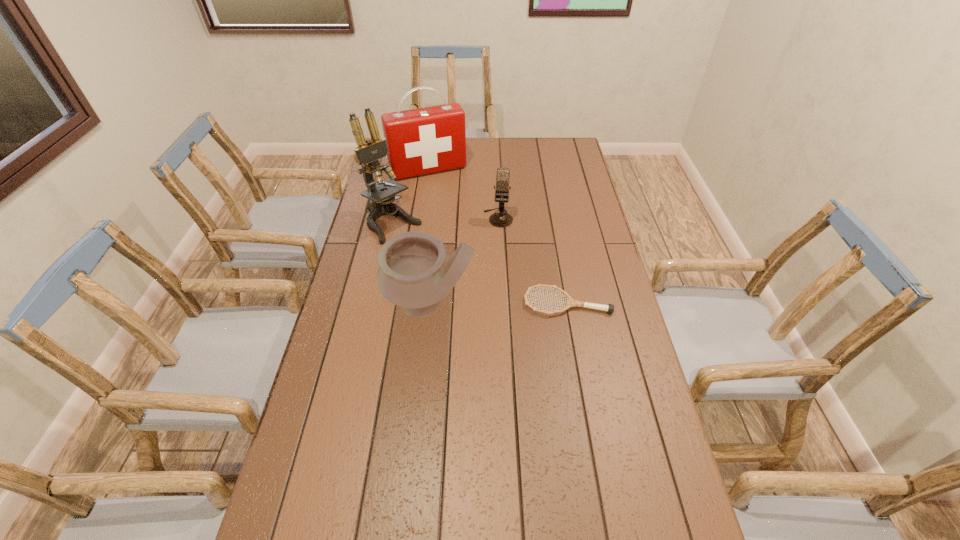
Where is `vacant space on the desktop that is between the pottery and the tennis racket and is positioned on the front face of the first-aid kit`? This screenshot has height=540, width=960. vacant space on the desktop that is between the pottery and the tennis racket and is positioned on the front face of the first-aid kit is located at coordinates point(492,303).

In order to click on vacant space on the desktop that is between the pottery and the tennis racket and is positioned on the front-facing side of the fourth tallest object in this screenshot , I will do `click(489, 303)`.

Identify the location of free space on the desktop that is between the third tallest object and the shortest object and is positioned at the eyepieces of the microscope. (485, 303).